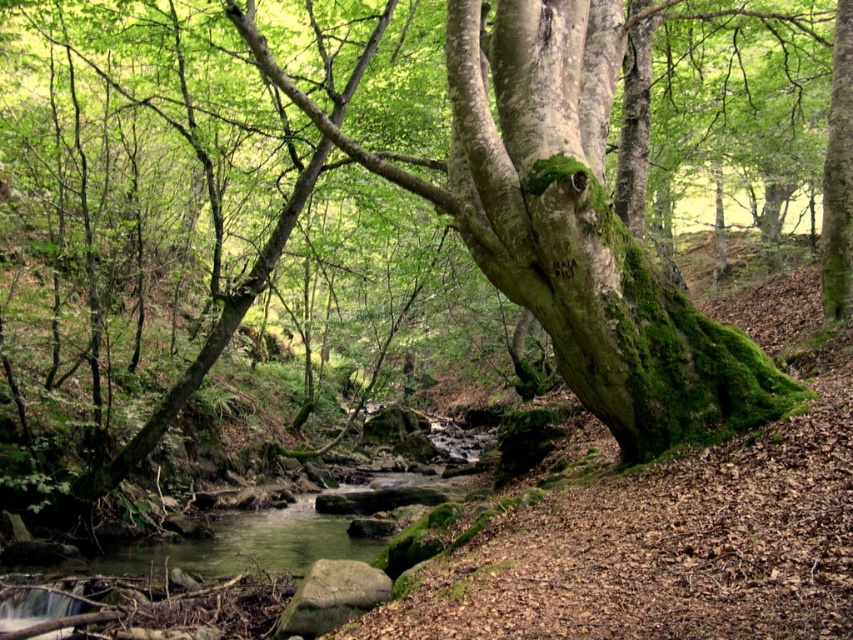
Which of these two, green mossy tree trunk at center or green mossy tree trunk at upper right, stands shorter?

green mossy tree trunk at center is shorter.

Which is more to the left, green mossy tree trunk at center or green mossy tree trunk at upper right?

From the viewer's perspective, green mossy tree trunk at center appears more on the left side.

Which is behind, point (578, 266) or point (844, 280)?

The point (844, 280) is behind.

You are a GUI agent. You are given a task and a screenshot of the screen. Output one action in this format:
    pyautogui.click(x=<x>, y=<y>)
    Task: Click on the green mossy tree trunk at center
    Image resolution: width=853 pixels, height=640 pixels.
    Given the screenshot: What is the action you would take?
    pyautogui.click(x=631, y=324)